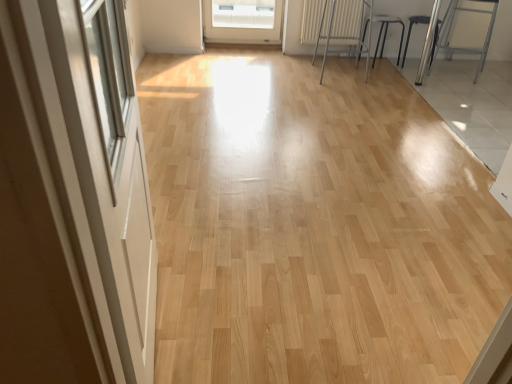
Where is `spots to the right of white glossy screen door at left`? This screenshot has height=384, width=512. spots to the right of white glossy screen door at left is located at coordinates (260, 323).